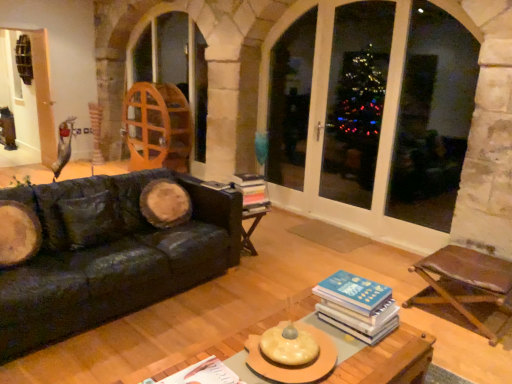
Question: Visually, is white paper book at center, positioned as the third book in back-to-front order, positioned to the left or to the right of transparent glass window at center?

Choices:
 (A) right
 (B) left

Answer: (B)

Question: Is white paper book at center, the 1th book when ordered from bottom to top, situated inside transparent glass window at center or outside?

Choices:
 (A) inside
 (B) outside

Answer: (B)

Question: Which object is positioned closest to the brown leather chair at lower right?

Choices:
 (A) hardcover books at center, which is the second book from left to right
 (B) transparent glass screen door at center, the 1th screen door positioned from the right
 (C) wooden screen door at upper left, the 2th screen door in the right-to-left sequence
 (D) transparent glass window at center
 (E) wooden coffee table at center

Answer: (E)

Question: Which object is positioned farthest from the transparent glass screen door at center, the 1th screen door positioned from the right?

Choices:
 (A) wooden coffee table at center
 (B) brown leather chair at lower right
 (C) white paper book at center, marked as the 1th book in a front-to-back arrangement
 (D) transparent glass window at center
 (E) wooden screen door at upper left, which is the 1th screen door in left-to-right order

Answer: (E)